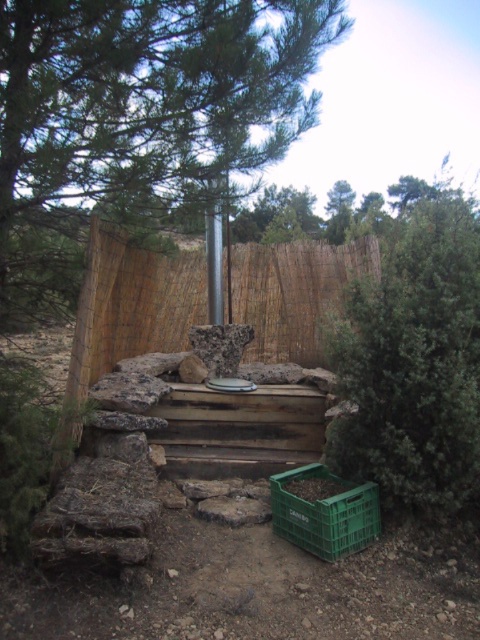
Who is more distant from viewer, (397,262) or (211,186)?

The point (211,186) is behind.

Can you confirm if green leafy tree at right is positioned below metallic pole at center?

Indeed, green leafy tree at right is positioned under metallic pole at center.

From the picture: Who is more distant from viewer, (389, 308) or (207, 307)?

The point (207, 307) is more distant.

Image resolution: width=480 pixels, height=640 pixels. Find the location of `green leafy tree at right`. green leafy tree at right is located at coordinates (414, 356).

Does green leafy tree at center have a smaller size compared to metallic pole at center?

Actually, green leafy tree at center might be larger than metallic pole at center.

Is point (224, 49) closer to camera compared to point (208, 301)?

Yes, point (224, 49) is in front of point (208, 301).

Who is more forward, [91,177] or [219,244]?

Point [91,177] is more forward.

Where is `green leafy tree at center`? green leafy tree at center is located at coordinates (136, 118).

Can you confirm if green leafy tree at right is smaller than green plastic crate at lower center?

No, green leafy tree at right is not smaller than green plastic crate at lower center.

You are a GUI agent. You are given a task and a screenshot of the screen. Output one action in this format:
    pyautogui.click(x=<x>, y=<y>)
    Task: Click on the green leafy tree at right
    
    Given the screenshot: What is the action you would take?
    pyautogui.click(x=414, y=356)